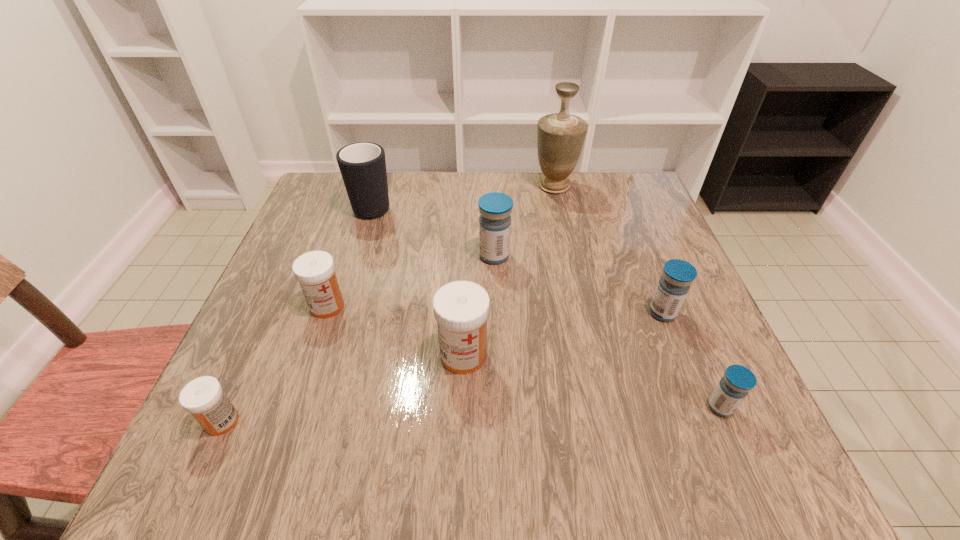
Locate an element on the screen. the tallest object is located at coordinates (560, 136).

Where is `the sixth object from left to right`? This screenshot has height=540, width=960. the sixth object from left to right is located at coordinates (560, 136).

In order to click on mug in this screenshot , I will do `click(362, 165)`.

Identify the location of the biggest blue medicine. (495, 208).

Image resolution: width=960 pixels, height=540 pixels. In order to click on the sixth nearest object in this screenshot , I will do `click(495, 208)`.

The image size is (960, 540). In order to click on the third nearest object in this screenshot , I will do `click(461, 308)`.

I want to click on the third nearest medicine, so pos(461,308).

I want to click on the second nearest blue medicine, so click(x=677, y=276).

Locate an element on the screen. The width and height of the screenshot is (960, 540). the fifth medicine from right to left is located at coordinates (315, 271).

You are a GUI agent. You are given a task and a screenshot of the screen. Output one action in this format:
    pyautogui.click(x=<x>, y=<y>)
    Task: Click on the second smallest white medicine
    The width and height of the screenshot is (960, 540).
    Given the screenshot: What is the action you would take?
    pyautogui.click(x=315, y=271)